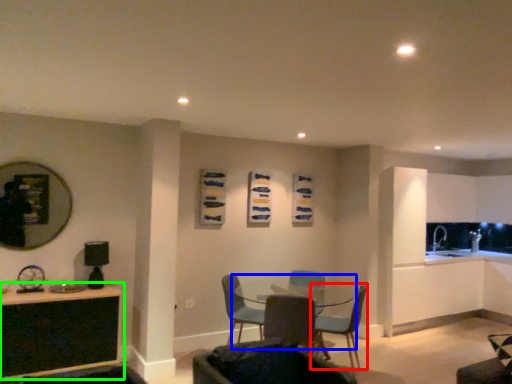
Question: Which object is the closest to the chair (highlighted by a red box)? Choose among these: round table (highlighted by a blue box) or table (highlighted by a green box).

Choices:
 (A) round table
 (B) table

Answer: (A)